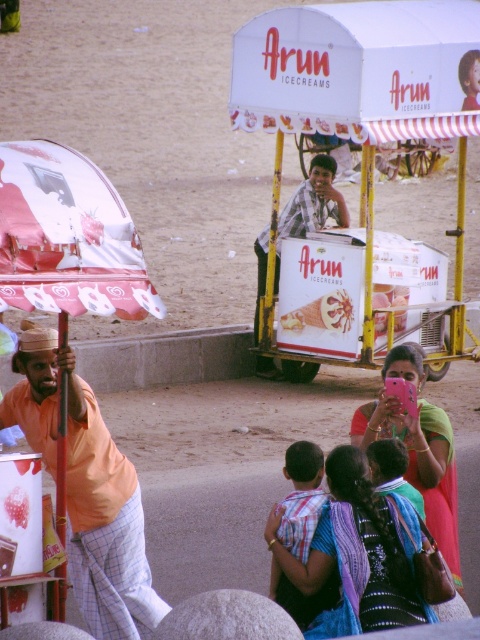
Question: Considering the real-world distances, which object is farthest from the orange cotton shirt at left?

Choices:
 (A) blue fabric sari at lower center
 (B) white cardboard cart at center
 (C) matte pink phone at center

Answer: (B)

Question: Is orange cotton shirt at left positioned in front of blue fabric sari at lower center?

Choices:
 (A) no
 (B) yes

Answer: (B)

Question: Considering the real-world distances, which object is farthest from the blue fabric sari at lower center?

Choices:
 (A) white cardboard cart at center
 (B) orange cotton shirt at left
 (C) matte pink phone at center

Answer: (A)

Question: Which of the following is the farthest from the observer?

Choices:
 (A) blue fabric sari at lower center
 (B) orange cotton shirt at left

Answer: (A)

Question: Does white cardboard cart at center lie behind orange cotton shirt at left?

Choices:
 (A) no
 (B) yes

Answer: (B)

Question: Can you confirm if white cardboard cart at center is positioned to the right of matte pink phone at center?

Choices:
 (A) yes
 (B) no

Answer: (A)